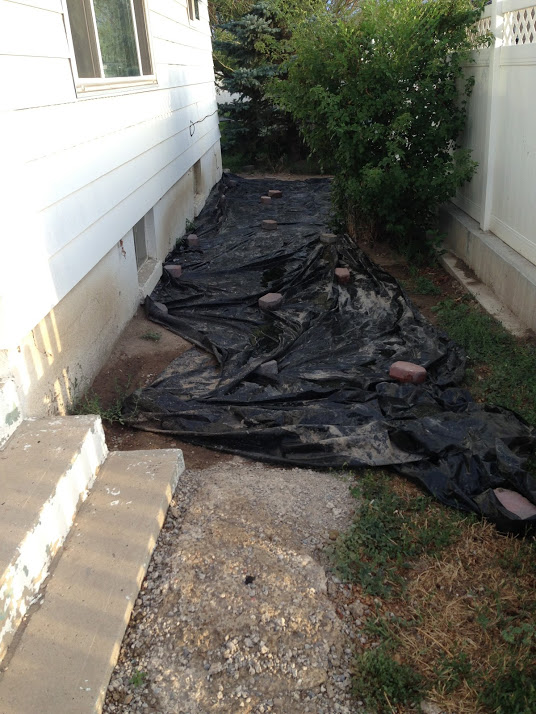
This screenshot has height=714, width=536. Find the location of `basement window`. basement window is located at coordinates (146, 240).